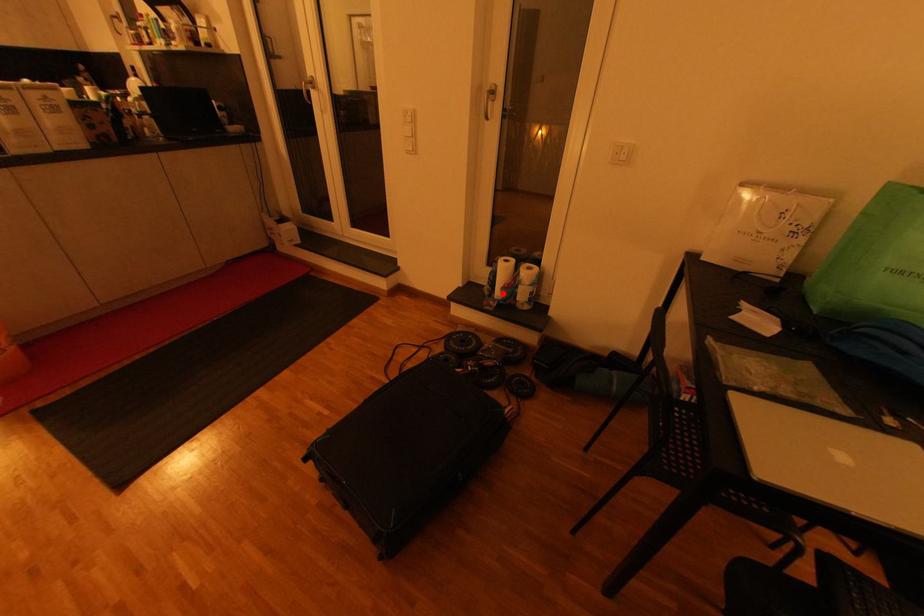
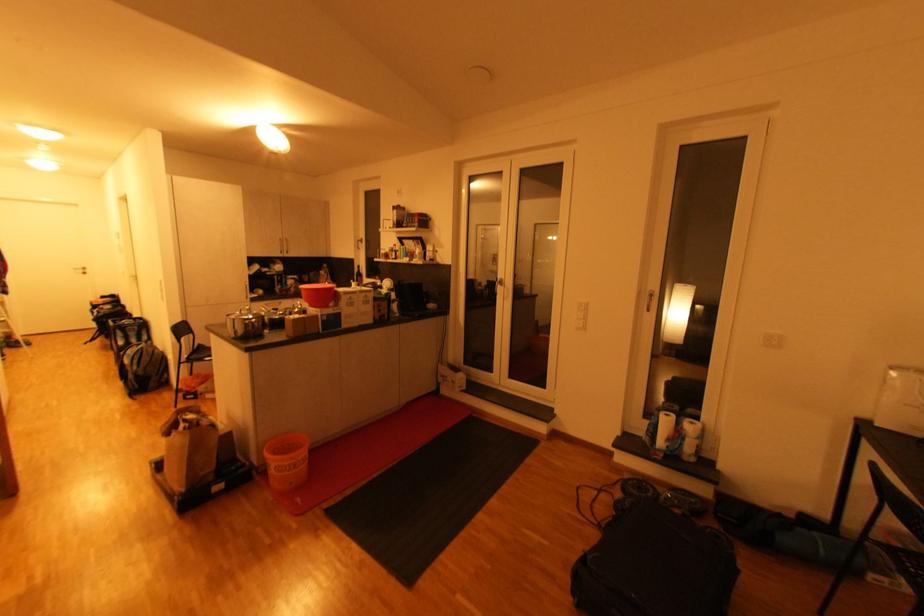
Question: I am providing you with two images of the same scene from different viewpoints. A red point is marked on the first image. At the location where the point appears in image 1, is it still visible in image 2?

Choices:
 (A) Yes
 (B) No

Answer: (A)